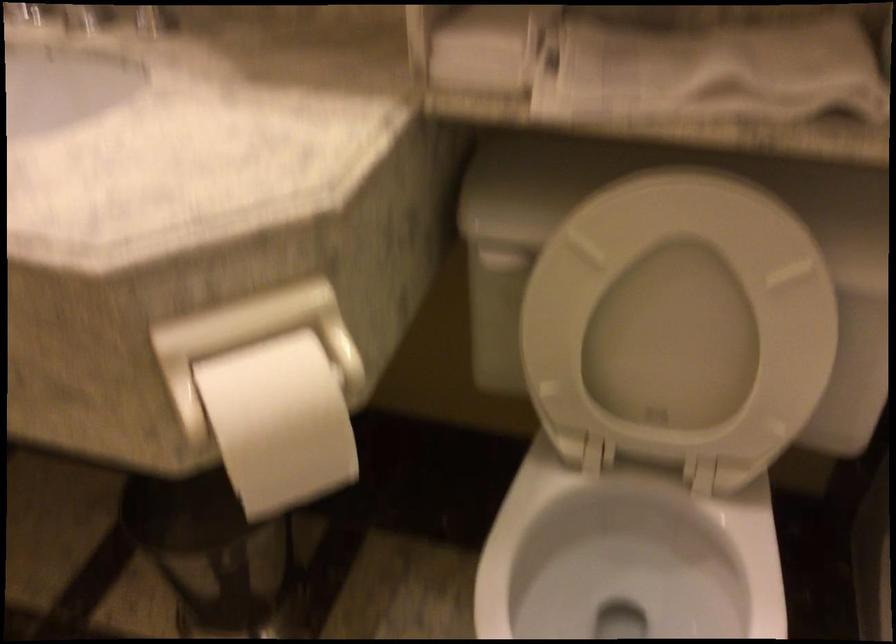
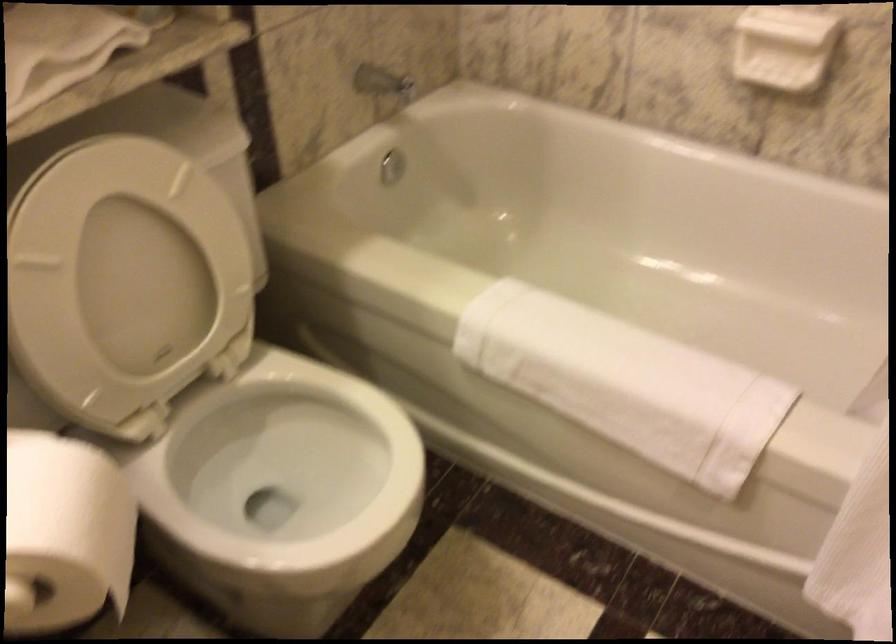
In the second image, find the point that corresponds to the point at 255,412 in the first image.

(64, 534)